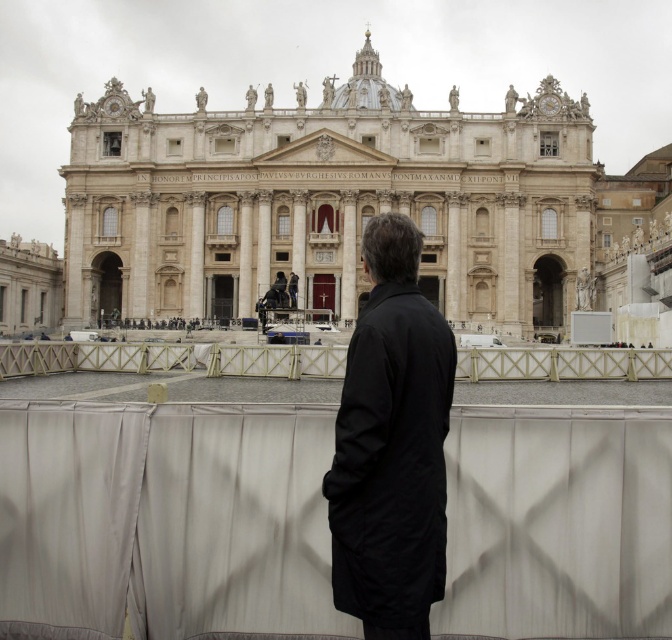
You are a tourist standing in front of the beige stone palace at center and the white wooden rail at center. Which object is closer to you?

The beige stone palace at center is closer to you than the white wooden rail at center.

Looking at this image, you are a tourist visiting this historic cathedral and want to take a photo of the central dome while standing near the black matte coat at center and the white wooden rail at center. Which object should you move closer to in order to get a better view of the dome?

You should move closer to the black matte coat at center because it is closer to the viewer than the white wooden rail at center, providing a better vantage point for photographing the central dome.

You are standing in front of the beige stone palace at center and want to take a photo of its facade. However, there is a white wooden rail at center in the way. Can you move around the rail to capture the entire palace in your shot?

The beige stone palace at center is located above the white wooden rail at center, so you can position yourself lower or adjust your angle to include the entire palace facade while avoiding obstruction from the rail.